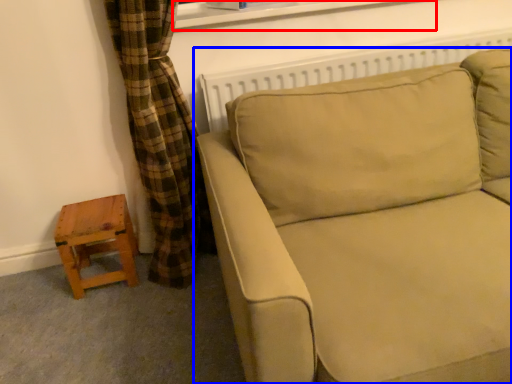
Question: Which object appears closest to the camera in this image, window frame (highlighted by a red box) or studio couch (highlighted by a blue box)?

Choices:
 (A) window frame
 (B) studio couch

Answer: (B)